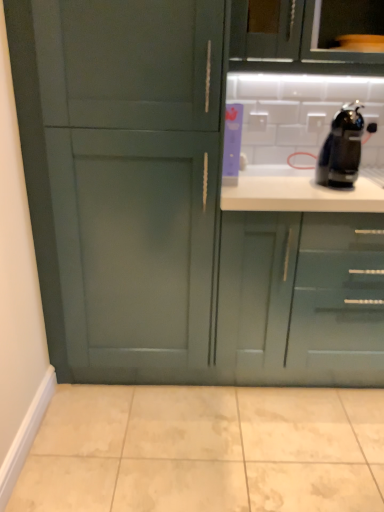
Where is `black glossy coffee machine at upper right`? black glossy coffee machine at upper right is located at coordinates (341, 149).

Describe the element at coordinates (302, 298) in the screenshot. I see `glossy teal cabinet at lower right, marked as the 1th cabinetry in a right-to-left arrangement` at that location.

Measure the distance between point (301,51) and camera.

A distance of 1.67 meters exists between point (301,51) and camera.

Where is `black glossy coffee machine at upper right`? black glossy coffee machine at upper right is located at coordinates (341, 149).

From a real-world perspective, which cabinetry is the 1st one above the glossy teal cabinet at lower right, marked as the 3th cabinetry in a left-to-right arrangement? Please provide its 2D coordinates.

[(199, 192)]

Could glossy teal cabinet at lower right, marked as the 1th cabinetry in a right-to-left arrangement, be considered to be inside matte green cabinet at center, the third cabinetry viewed from the right?

Actually, glossy teal cabinet at lower right, marked as the 1th cabinetry in a right-to-left arrangement, is outside matte green cabinet at center, the third cabinetry viewed from the right.

Is point (132, 173) closer to viewer compared to point (308, 290)?

Yes.

Based on the photo, from the image's perspective, would you say matte green cabinet at center, the first cabinetry positioned from the left, is positioned over glossy teal cabinet at lower right, marked as the 3th cabinetry in a left-to-right arrangement?

Indeed, from the image's perspective, matte green cabinet at center, the first cabinetry positioned from the left, is shown above glossy teal cabinet at lower right, marked as the 3th cabinetry in a left-to-right arrangement.

How distant is matte green cabinet at center, the third cabinetry viewed from the right, from black glossy coffee machine at upper right?

A distance of 21.39 inches exists between matte green cabinet at center, the third cabinetry viewed from the right, and black glossy coffee machine at upper right.

Is matte green cabinet at center, the third cabinetry viewed from the right, not close to black glossy coffee machine at upper right?

They are positioned close to each other.

From the image's perspective, which is above, matte green cabinet at center, the first cabinetry positioned from the left, or black glossy coffee machine at upper right?

black glossy coffee machine at upper right appears higher in the image.

Is matte green cabinet at center, the third cabinetry viewed from the right, far from beige marble tile at lower center?

They are positioned close to each other.

Is matte green cabinet at center, the third cabinetry viewed from the right, inside the boundaries of beige marble tile at lower center, or outside?

matte green cabinet at center, the third cabinetry viewed from the right, is not enclosed by beige marble tile at lower center.

Identify the location of ceramic tile on the right side of matte green cabinet at center, the first cabinetry positioned from the left. This screenshot has width=384, height=512. (206, 450).

Which of these two, matte green cabinet at center, the first cabinetry positioned from the left, or beige marble tile at lower center, is smaller?

beige marble tile at lower center.

Is beige marble tile at lower center oriented away from glossy teal cabinet at lower right, marked as the 1th cabinetry in a right-to-left arrangement?

No.

How many degrees apart are the facing directions of beige marble tile at lower center and glossy teal cabinet at lower right, marked as the 1th cabinetry in a right-to-left arrangement?

They differ by 91.2 degrees in their facing directions.

Which of these two, beige marble tile at lower center or glossy teal cabinet at lower right, marked as the 3th cabinetry in a left-to-right arrangement, is smaller?

Smaller between the two is beige marble tile at lower center.

Considering the relative sizes of black glossy coffee machine at upper right and glossy teal cabinet at lower right, marked as the 3th cabinetry in a left-to-right arrangement, in the image provided, is black glossy coffee machine at upper right shorter than glossy teal cabinet at lower right, marked as the 3th cabinetry in a left-to-right arrangement,?

Correct, black glossy coffee machine at upper right is not as tall as glossy teal cabinet at lower right, marked as the 3th cabinetry in a left-to-right arrangement.

Who is bigger, black glossy coffee machine at upper right or glossy teal cabinet at lower right, marked as the 1th cabinetry in a right-to-left arrangement?

Bigger between the two is glossy teal cabinet at lower right, marked as the 1th cabinetry in a right-to-left arrangement.

From the image's perspective, which is below, black glossy coffee machine at upper right or glossy teal cabinet at lower right, marked as the 1th cabinetry in a right-to-left arrangement?

glossy teal cabinet at lower right, marked as the 1th cabinetry in a right-to-left arrangement.

Between black glossy coffee machine at upper right and glossy teal cabinet at lower right, marked as the 1th cabinetry in a right-to-left arrangement, which one has larger width?

Wider between the two is glossy teal cabinet at lower right, marked as the 1th cabinetry in a right-to-left arrangement.

Locate an element on the screen. This screenshot has height=512, width=384. cabinetry that is the 3rd one when counting leftward from the black glossy coffee machine at upper right is located at coordinates (199, 192).

Based on the photo, from a real-world perspective, is black glossy coffee machine at upper right physically above matte green cabinet at center, the third cabinetry viewed from the right?

Answer: Yes.

From the image's perspective, would you say black glossy coffee machine at upper right is positioned over matte green cabinet at center, the first cabinetry positioned from the left?

Indeed, from the image's perspective, black glossy coffee machine at upper right is shown above matte green cabinet at center, the first cabinetry positioned from the left.

Between matte green cabinet at center, the third cabinetry viewed from the right, and green matte cabinet at upper center, the second cabinetry in the left-to-right sequence, which one has larger width?

Wider between the two is matte green cabinet at center, the third cabinetry viewed from the right.

Can you confirm if matte green cabinet at center, the first cabinetry positioned from the left, is smaller than green matte cabinet at upper center, which is the second cabinetry in right-to-left order?

No.

Locate an element on the screen. This screenshot has height=512, width=384. the 1st cabinetry below the green matte cabinet at upper center, which is the second cabinetry in right-to-left order (from the image's perspective) is located at coordinates (199, 192).

Between point (211, 208) and point (274, 7), which one is positioned behind?

The point (211, 208) is farther from the camera.

You are a GUI agent. You are given a task and a screenshot of the screen. Output one action in this format:
    pyautogui.click(x=<x>, y=<y>)
    Task: Click on the cabinetry that is the 2nd object to the right of the matte green cabinet at center, the third cabinetry viewed from the right, starting at the anchor
    
    Given the screenshot: What is the action you would take?
    pyautogui.click(x=302, y=298)

You are a GUI agent. You are given a task and a screenshot of the screen. Output one action in this format:
    pyautogui.click(x=<x>, y=<y>)
    Task: Click on the 3rd cabinetry to the left of the black glossy coffee machine at upper right, starting your count from the anchor
    This screenshot has height=512, width=384.
    Given the screenshot: What is the action you would take?
    pyautogui.click(x=199, y=192)

Estimate the real-world distances between objects in this image. Which object is further from black glossy coffee machine at upper right, beige marble tile at lower center or matte green cabinet at center, the first cabinetry positioned from the left?

beige marble tile at lower center is further to black glossy coffee machine at upper right.

Estimate the real-world distances between objects in this image. Which object is further from green matte cabinet at upper center, the second cabinetry in the left-to-right sequence, glossy teal cabinet at lower right, marked as the 3th cabinetry in a left-to-right arrangement, or matte green cabinet at center, the first cabinetry positioned from the left?

glossy teal cabinet at lower right, marked as the 3th cabinetry in a left-to-right arrangement, is positioned further to the anchor green matte cabinet at upper center, the second cabinetry in the left-to-right sequence.

When comparing their distances from glossy teal cabinet at lower right, marked as the 3th cabinetry in a left-to-right arrangement, does black glossy coffee machine at upper right or beige marble tile at lower center seem closer?

Among the two, black glossy coffee machine at upper right is located nearer to glossy teal cabinet at lower right, marked as the 3th cabinetry in a left-to-right arrangement.

Based on their spatial positions, is green matte cabinet at upper center, which is the second cabinetry in right-to-left order, or matte green cabinet at center, the first cabinetry positioned from the left, further from black glossy coffee machine at upper right?

matte green cabinet at center, the first cabinetry positioned from the left, lies further to black glossy coffee machine at upper right than the other object.

From the image, which object appears to be nearer to black glossy coffee machine at upper right, glossy teal cabinet at lower right, marked as the 3th cabinetry in a left-to-right arrangement, or green matte cabinet at upper center, the second cabinetry in the left-to-right sequence?

green matte cabinet at upper center, the second cabinetry in the left-to-right sequence, is positioned closer to the anchor black glossy coffee machine at upper right.

From the image, which object appears to be nearer to glossy teal cabinet at lower right, marked as the 3th cabinetry in a left-to-right arrangement, beige marble tile at lower center or matte green cabinet at center, the third cabinetry viewed from the right?

matte green cabinet at center, the third cabinetry viewed from the right, is positioned closer to the anchor glossy teal cabinet at lower right, marked as the 3th cabinetry in a left-to-right arrangement.

Consider the image. From the image, which object appears to be nearer to green matte cabinet at upper center, the second cabinetry in the left-to-right sequence, matte green cabinet at center, the third cabinetry viewed from the right, or beige marble tile at lower center?

matte green cabinet at center, the third cabinetry viewed from the right, is closer to green matte cabinet at upper center, the second cabinetry in the left-to-right sequence.

Which object lies nearer to the anchor point glossy teal cabinet at lower right, marked as the 1th cabinetry in a right-to-left arrangement, green matte cabinet at upper center, which is the second cabinetry in right-to-left order, or black glossy coffee machine at upper right?

black glossy coffee machine at upper right is positioned closer to the anchor glossy teal cabinet at lower right, marked as the 1th cabinetry in a right-to-left arrangement.

At what (x,y) coordinates should I click in order to perform the action: click on cabinetry between matte green cabinet at center, the first cabinetry positioned from the left, and beige marble tile at lower center in the up-down direction. Please return your answer as a coordinate pair (x, y). This screenshot has width=384, height=512. Looking at the image, I should click on (302, 298).

Locate an element on the screen. The image size is (384, 512). cabinetry that lies between green matte cabinet at upper center, which is the second cabinetry in right-to-left order, and glossy teal cabinet at lower right, marked as the 1th cabinetry in a right-to-left arrangement, from top to bottom is located at coordinates (199, 192).

What are the coordinates of `coffee machine between green matte cabinet at upper center, the second cabinetry in the left-to-right sequence, and glossy teal cabinet at lower right, marked as the 3th cabinetry in a left-to-right arrangement, from top to bottom` in the screenshot? It's located at (341, 149).

Image resolution: width=384 pixels, height=512 pixels. I want to click on coffee machine that lies between green matte cabinet at upper center, the second cabinetry in the left-to-right sequence, and beige marble tile at lower center from top to bottom, so [x=341, y=149].